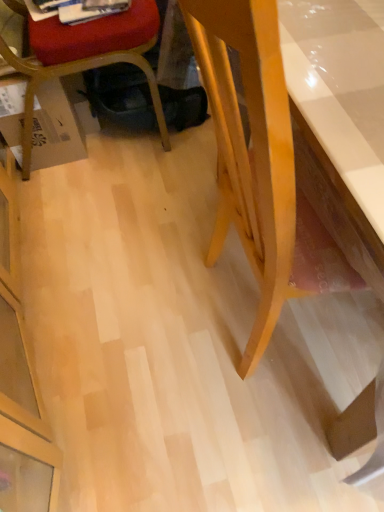
Measure the distance between white glossy magazine at upper left and camera.

white glossy magazine at upper left and camera are 1.26 meters apart from each other.

What do you see at coordinates (74, 11) in the screenshot? This screenshot has width=384, height=512. I see `white glossy magazine at upper left` at bounding box center [74, 11].

Describe the element at coordinates (251, 148) in the screenshot. I see `light wood desk at right` at that location.

The height and width of the screenshot is (512, 384). I want to click on light wood desk at right, so click(251, 148).

Where is `matte plastic chair at lower left`? This screenshot has width=384, height=512. matte plastic chair at lower left is located at coordinates (85, 55).

This screenshot has width=384, height=512. What are the coordinates of `brown cardboard box at lower left` in the screenshot? It's located at point(55,128).

Is white glossy magazine at upper left further to the viewer compared to brown cardboard box at lower left?

That is False.

Is white glossy magazine at upper left at the right side of brown cardboard box at lower left?

Yes.

Based on the photo, which of these two, white glossy magazine at upper left or brown cardboard box at lower left, stands shorter?

With less height is white glossy magazine at upper left.

How far apart are white glossy magazine at upper left and brown cardboard box at lower left?

white glossy magazine at upper left is 12.08 inches from brown cardboard box at lower left.

In the scene shown: Is the surface of matte plastic chair at lower left in direct contact with light wood desk at right?

No.

Does matte plastic chair at lower left come behind light wood desk at right?

That is True.

From the image's perspective, which object appears higher, matte plastic chair at lower left or light wood desk at right?

matte plastic chair at lower left.

In the scene shown: Is white glossy magazine at upper left positioned with its back to matte plastic chair at lower left?

Yes, white glossy magazine at upper left is positioned with its back facing matte plastic chair at lower left.

Is white glossy magazine at upper left positioned before matte plastic chair at lower left?

No, it is not.

Is white glossy magazine at upper left touching matte plastic chair at lower left?

No, white glossy magazine at upper left is not beside matte plastic chair at lower left.

Locate an element on the screen. The image size is (384, 512). magazine above the matte plastic chair at lower left (from the image's perspective) is located at coordinates (74, 11).

Who is shorter, white glossy magazine at upper left or light wood desk at right?

Standing shorter between the two is white glossy magazine at upper left.

Considering the sizes of objects white glossy magazine at upper left and light wood desk at right in the image provided, who is wider, white glossy magazine at upper left or light wood desk at right?

light wood desk at right.

Is white glossy magazine at upper left positioned far away from light wood desk at right?

white glossy magazine at upper left is actually quite close to light wood desk at right.

Is white glossy magazine at upper left to the left of light wood desk at right from the viewer's perspective?

Indeed, white glossy magazine at upper left is positioned on the left side of light wood desk at right.

Is matte plastic chair at lower left far from brown cardboard box at lower left?

matte plastic chair at lower left is actually quite close to brown cardboard box at lower left.

From a real-world perspective, which is physically above, matte plastic chair at lower left or brown cardboard box at lower left?

In real-world perspective, matte plastic chair at lower left is above.

Locate an element on the screen. The image size is (384, 512). chair positioned vertically above the brown cardboard box at lower left (from a real-world perspective) is located at coordinates (85, 55).

Is point (272, 221) closer to camera compared to point (31, 42)?

Yes, point (272, 221) is closer to viewer.

Is light wood desk at right shorter than matte plastic chair at lower left?

Incorrect, the height of light wood desk at right does not fall short of that of matte plastic chair at lower left.

Locate an element on the screen. chair on the left of light wood desk at right is located at coordinates [x=85, y=55].

Visually, is light wood desk at right positioned to the left or to the right of brown cardboard box at lower left?

Based on their positions, light wood desk at right is located to the right of brown cardboard box at lower left.

Does light wood desk at right have a smaller size compared to brown cardboard box at lower left?

No, light wood desk at right is not smaller than brown cardboard box at lower left.

Is light wood desk at right taller or shorter than brown cardboard box at lower left?

Considering their sizes, light wood desk at right has more height than brown cardboard box at lower left.

From the image's perspective, which one is positioned higher, light wood desk at right or brown cardboard box at lower left?

brown cardboard box at lower left, from the image's perspective.

Find the location of a particular element. Image resolution: width=384 pixels, height=512 pixels. cardboard box on the left of white glossy magazine at upper left is located at coordinates (55, 128).

In the image, there is a light wood desk at right. At what (x,y) coordinates should I click in order to perform the action: click on chair above it (from the image's perspective). Please return your answer as a coordinate pair (x, y). Looking at the image, I should click on (85, 55).

In the scene shown: Looking at the image, which one is located further to light wood desk at right, brown cardboard box at lower left or white glossy magazine at upper left?

The object further to light wood desk at right is white glossy magazine at upper left.

Which object lies nearer to the anchor point brown cardboard box at lower left, matte plastic chair at lower left or light wood desk at right?

matte plastic chair at lower left is closer to brown cardboard box at lower left.

From the image, which object appears to be farther from white glossy magazine at upper left, brown cardboard box at lower left or matte plastic chair at lower left?

Among the two, brown cardboard box at lower left is located further to white glossy magazine at upper left.

When comparing their distances from white glossy magazine at upper left, does matte plastic chair at lower left or light wood desk at right seem further?

light wood desk at right is further to white glossy magazine at upper left.

When comparing their distances from matte plastic chair at lower left, does light wood desk at right or brown cardboard box at lower left seem further?

Based on the image, light wood desk at right appears to be further to matte plastic chair at lower left.

In the scene shown: Looking at the image, which one is located further to matte plastic chair at lower left, white glossy magazine at upper left or light wood desk at right?

light wood desk at right lies further to matte plastic chair at lower left than the other object.

Considering their positions, is matte plastic chair at lower left positioned further to light wood desk at right than white glossy magazine at upper left?

The object further to light wood desk at right is white glossy magazine at upper left.

Which object lies nearer to the anchor point light wood desk at right, white glossy magazine at upper left or brown cardboard box at lower left?

Based on the image, brown cardboard box at lower left appears to be nearer to light wood desk at right.

Locate an element on the screen. chair between brown cardboard box at lower left and light wood desk at right from left to right is located at coordinates (85, 55).

The height and width of the screenshot is (512, 384). Find the location of `magazine between matte plastic chair at lower left and light wood desk at right`. magazine between matte plastic chair at lower left and light wood desk at right is located at coordinates (74, 11).

The width and height of the screenshot is (384, 512). What are the coordinates of `magazine between brown cardboard box at lower left and light wood desk at right from left to right` in the screenshot? It's located at (74, 11).

I want to click on chair between white glossy magazine at upper left and brown cardboard box at lower left in the up-down direction, so click(x=85, y=55).